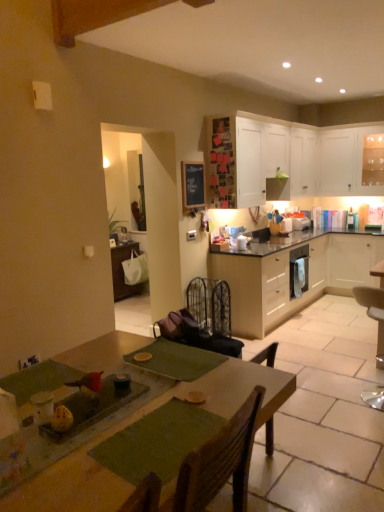
Question: Which direction should I rotate to face white matte cabinet at upper center, placed as the third cabinetry when sorted from bottom to top, — up or down?

Choices:
 (A) up
 (B) down

Answer: (A)

Question: From a real-world perspective, is black wrought iron armchair at center under metallic silver chair at lower right?

Choices:
 (A) yes
 (B) no

Answer: (A)

Question: Is the depth of black wrought iron armchair at center less than that of metallic silver chair at lower right?

Choices:
 (A) no
 (B) yes

Answer: (A)

Question: From the image's perspective, does black wrought iron armchair at center appear higher than metallic silver chair at lower right?

Choices:
 (A) no
 (B) yes

Answer: (B)

Question: Does black wrought iron armchair at center have a greater width compared to metallic silver chair at lower right?

Choices:
 (A) yes
 (B) no

Answer: (B)

Question: Considering the relative sizes of black wrought iron armchair at center and metallic silver chair at lower right in the image provided, is black wrought iron armchair at center thinner than metallic silver chair at lower right?

Choices:
 (A) yes
 (B) no

Answer: (A)

Question: From the image's perspective, is black wrought iron armchair at center located beneath metallic silver chair at lower right?

Choices:
 (A) yes
 (B) no

Answer: (B)

Question: Considering the relative sizes of light wood/veneer cabinets at center, the 1th cabinetry when ordered from bottom to top, and black wrought iron armchair at center in the image provided, is light wood/veneer cabinets at center, the 1th cabinetry when ordered from bottom to top, smaller than black wrought iron armchair at center?

Choices:
 (A) yes
 (B) no

Answer: (B)

Question: Does light wood/veneer cabinets at center, the 4th cabinetry from the top, have a lesser height compared to black wrought iron armchair at center?

Choices:
 (A) no
 (B) yes

Answer: (A)

Question: Considering the relative sizes of light wood/veneer cabinets at center, the 4th cabinetry from the top, and black wrought iron armchair at center in the image provided, is light wood/veneer cabinets at center, the 4th cabinetry from the top, taller than black wrought iron armchair at center?

Choices:
 (A) no
 (B) yes

Answer: (B)

Question: From the image's perspective, does light wood/veneer cabinets at center, the 1th cabinetry when ordered from bottom to top, appear lower than black wrought iron armchair at center?

Choices:
 (A) yes
 (B) no

Answer: (B)

Question: From a real-world perspective, is light wood/veneer cabinets at center, the 1th cabinetry when ordered from bottom to top, physically above black wrought iron armchair at center?

Choices:
 (A) yes
 (B) no

Answer: (A)

Question: Is black wrought iron armchair at center located within light wood/veneer cabinets at center, the 1th cabinetry when ordered from bottom to top?

Choices:
 (A) no
 (B) yes

Answer: (A)

Question: Is white glossy microwave at upper right, which is the first appliance in front-to-back order, not within white matte cabinet at right, the 3th cabinetry viewed from the top?

Choices:
 (A) yes
 (B) no

Answer: (A)